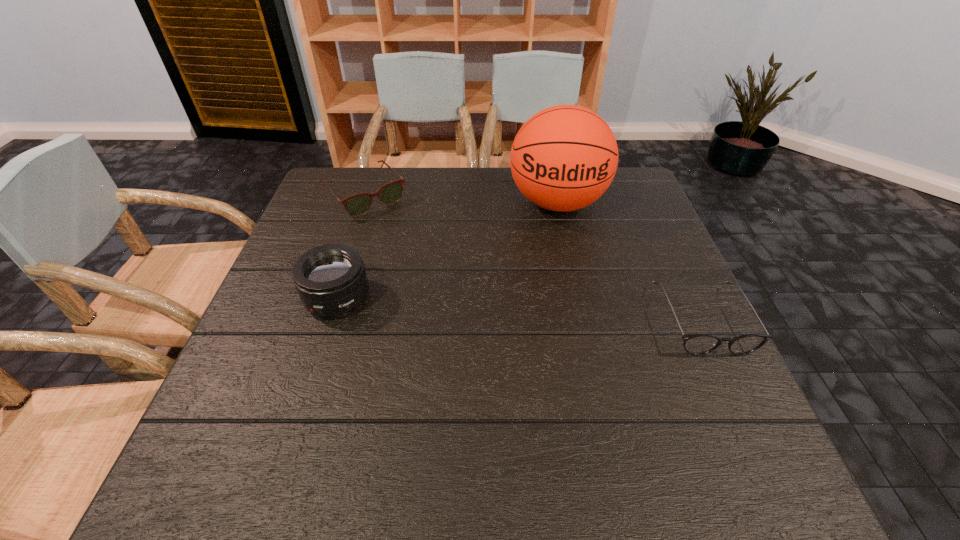
Where is `unoccupied position between the rightmost object and the basketball`? unoccupied position between the rightmost object and the basketball is located at coordinates (630, 261).

Locate an element on the screen. vacant region between the telephoto lens and the right spectacles is located at coordinates (519, 309).

Image resolution: width=960 pixels, height=540 pixels. I want to click on free space between the basketball and the farther spectacles, so click(461, 200).

Locate an element on the screen. free area in between the second tallest object and the right spectacles is located at coordinates (519, 309).

Locate an element on the screen. object that ranks as the second closest to the basketball is located at coordinates (358, 204).

Where is `object that is the closest to the farther spectacles`? object that is the closest to the farther spectacles is located at coordinates (331, 280).

Locate an element on the screen. This screenshot has width=960, height=540. vacant space that satisfies the following two spatial constraints: 1. on the front side of the second object from right to left; 2. on the left side of the farther spectacles is located at coordinates (363, 203).